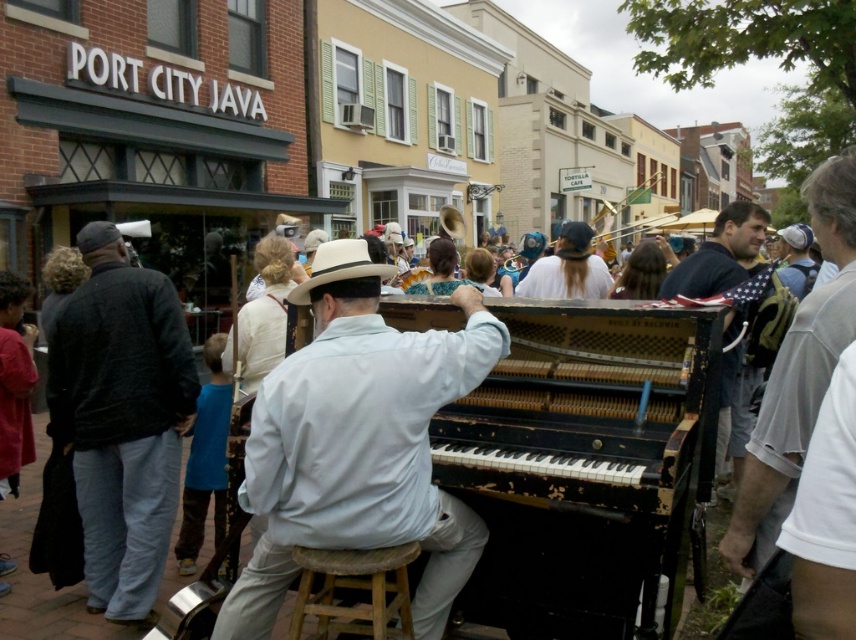
Can you confirm if black distressed piano at center is positioned to the right of white cotton shirt at center?

In fact, black distressed piano at center is to the left of white cotton shirt at center.

Between point (539, 452) and point (586, 298), which one is positioned in front?

Point (539, 452)

Identify the location of black distressed piano at center. The height and width of the screenshot is (640, 856). (583, 464).

Does light blue cotton shirt at center have a greater height compared to dark gray sweater at left?

Incorrect, light blue cotton shirt at center's height is not larger of dark gray sweater at left's.

This screenshot has height=640, width=856. Find the location of `light blue cotton shirt at center`. light blue cotton shirt at center is located at coordinates (358, 444).

Who is more distant from viewer, (x=488, y=504) or (x=397, y=593)?

Point (x=488, y=504)

Identify the location of black distressed piano at center. (583, 464).

Which is behind, point (706, 428) or point (377, 588)?

Positioned behind is point (706, 428).

Locate an element on the screen. Image resolution: width=856 pixels, height=640 pixels. black distressed piano at center is located at coordinates (583, 464).